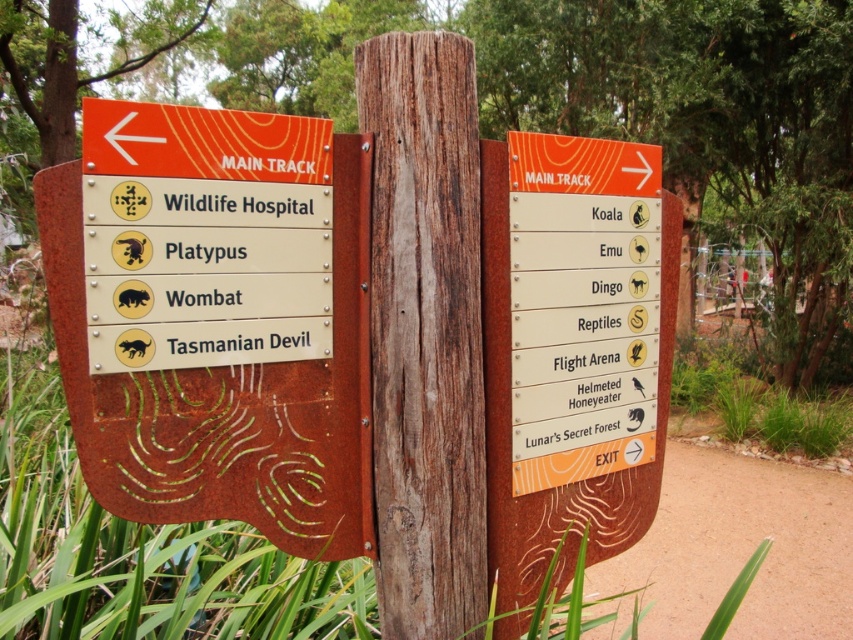
Is point (347, 554) positioned in front of point (434, 429)?

No, (347, 554) is further to viewer.

Is point (262, 392) more distant than point (386, 388)?

No.

Identify the location of rusty metal sign at left. This screenshot has width=853, height=640. (216, 317).

You are a GUI agent. You are given a task and a screenshot of the screen. Output one action in this format:
    pyautogui.click(x=<x>, y=<y>)
    Task: Click on the rusty metal sign at left
    This screenshot has width=853, height=640.
    Given the screenshot: What is the action you would take?
    pyautogui.click(x=216, y=317)

Locate an element on the screen. The height and width of the screenshot is (640, 853). rusty metal sign at left is located at coordinates (216, 317).

Who is more forward, (328, 452) or (560, 228)?

Positioned in front is point (328, 452).

Find the location of `rusty metal sign at left`. rusty metal sign at left is located at coordinates (216, 317).

Which is below, weathered wood post at center or orange wood sign at right?

weathered wood post at center

Is weathered wood post at center above orange wood sign at right?

No.

What do you see at coordinates (425, 332) in the screenshot? I see `weathered wood post at center` at bounding box center [425, 332].

Find the location of `weathered wood post at center`. weathered wood post at center is located at coordinates (425, 332).